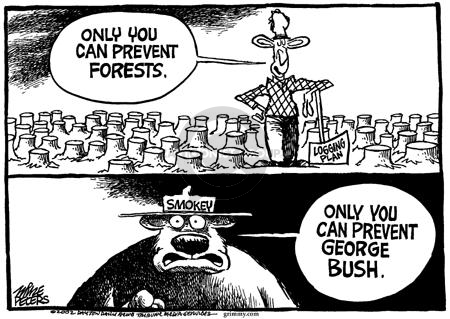
The height and width of the screenshot is (319, 450). Find the location of `the top frame of picture`. the top frame of picture is located at coordinates (370, 66).